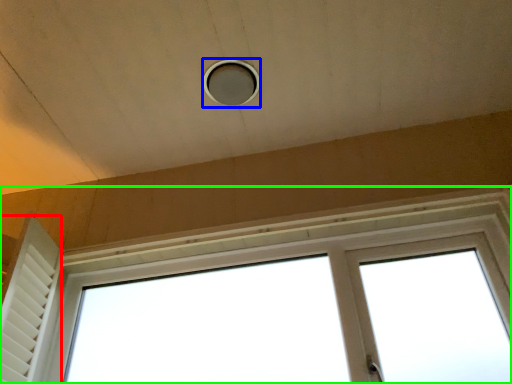
Question: Which is nearer to the shutter (highlighted by a red box)? hole (highlighted by a blue box) or window (highlighted by a green box).

Choices:
 (A) hole
 (B) window

Answer: (B)